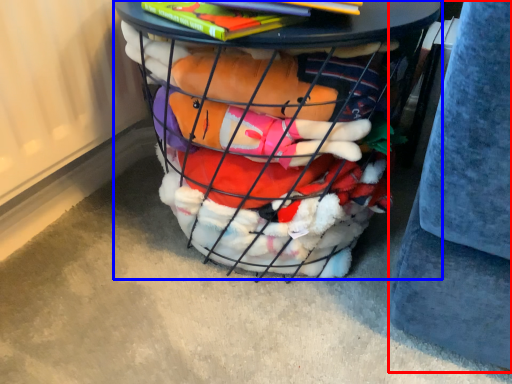
Question: Which of the following is the farthest to the observer, gray (highlighted by a red box) or furniture (highlighted by a blue box)?

Choices:
 (A) gray
 (B) furniture

Answer: (B)